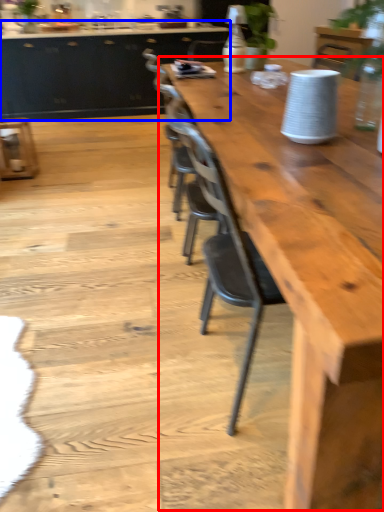
Question: Which object is further to the camera taking this photo, table (highlighted by a red box) or cabinetry (highlighted by a blue box)?

Choices:
 (A) table
 (B) cabinetry

Answer: (B)